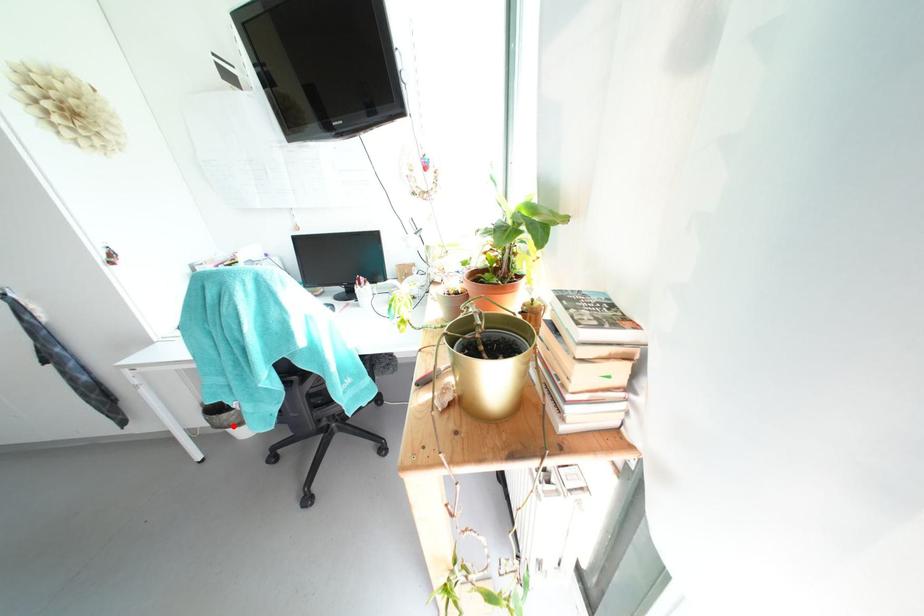
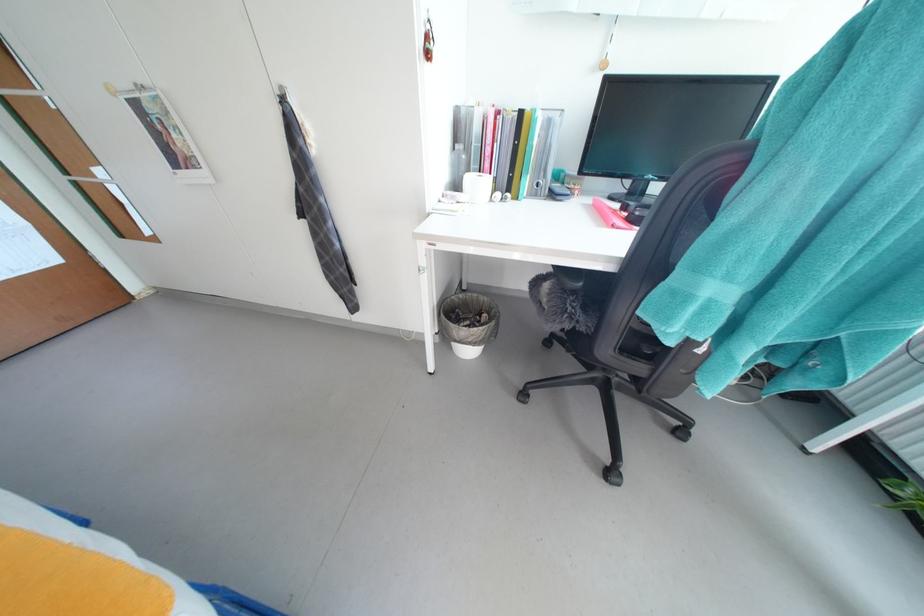
Question: I am providing you with two images of the same scene from different viewpoints. Given a red point in image1, look at the same physical point in image2. Is it:

Choices:
 (A) Closer to the viewpoint
 (B) Farther from the viewpoint

Answer: (A)